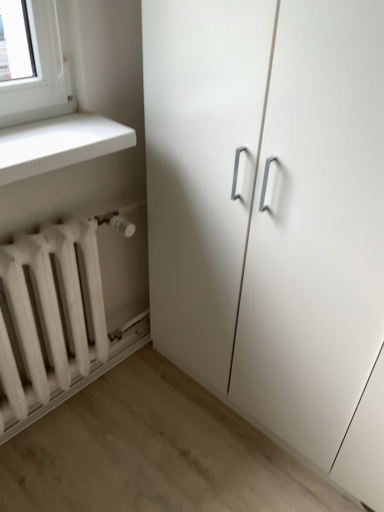
Question: From the image's perspective, relative to white matte radiator at lower left, is white matte cabinet at center above or below?

Choices:
 (A) above
 (B) below

Answer: (A)

Question: Visually, is white matte cabinet at center positioned to the left or to the right of white matte radiator at lower left?

Choices:
 (A) right
 (B) left

Answer: (A)

Question: From their relative heights in the image, would you say white matte cabinet at center is taller or shorter than white matte radiator at lower left?

Choices:
 (A) tall
 (B) short

Answer: (A)

Question: Considering the relative positions of white matte radiator at lower left and white matte cabinet at center in the image provided, is white matte radiator at lower left to the left or to the right of white matte cabinet at center?

Choices:
 (A) right
 (B) left

Answer: (B)

Question: Does point (31, 291) appear closer or farther from the camera than point (231, 350)?

Choices:
 (A) closer
 (B) farther

Answer: (A)

Question: Is white matte radiator at lower left taller or shorter than white matte cabinet at center?

Choices:
 (A) short
 (B) tall

Answer: (A)

Question: From a real-world perspective, is white matte radiator at lower left physically located above or below white matte cabinet at center?

Choices:
 (A) above
 (B) below

Answer: (B)